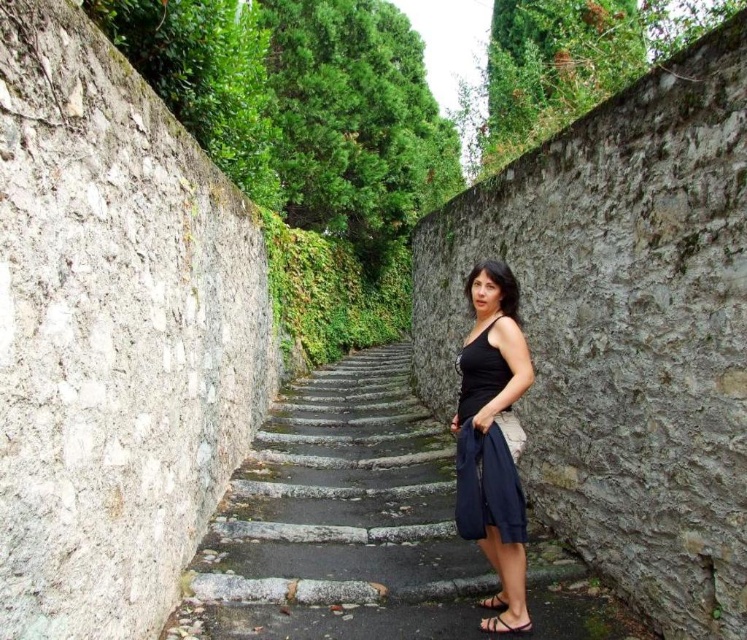
You are a photographer wanting to capture both the black matte dress at center and the black satin dress at center in the same frame. Which dress should you position your camera closer to in order to include both dresses in the shot?

You should position your camera closer to the black satin dress at center since the black matte dress at center is to the right of it, allowing both to be captured in the frame when centered.

You are a fashion designer observing the serene outdoor scene. You notice the black matte dress at center and the black leather sandal at lower center. Which object would you recommend to a client who prefers larger accessories?

The black matte dress at center is larger in size than the black leather sandal at lower center, so I would recommend the black matte dress at center for a client who prefers larger accessories.

You are a photographer setting up a shoot in this scene. You have the black satin dress at center and the black leather sandal at lower center. Which object is positioned to the left of the other?

The black satin dress at center is to the left of the black leather sandal at lower center.